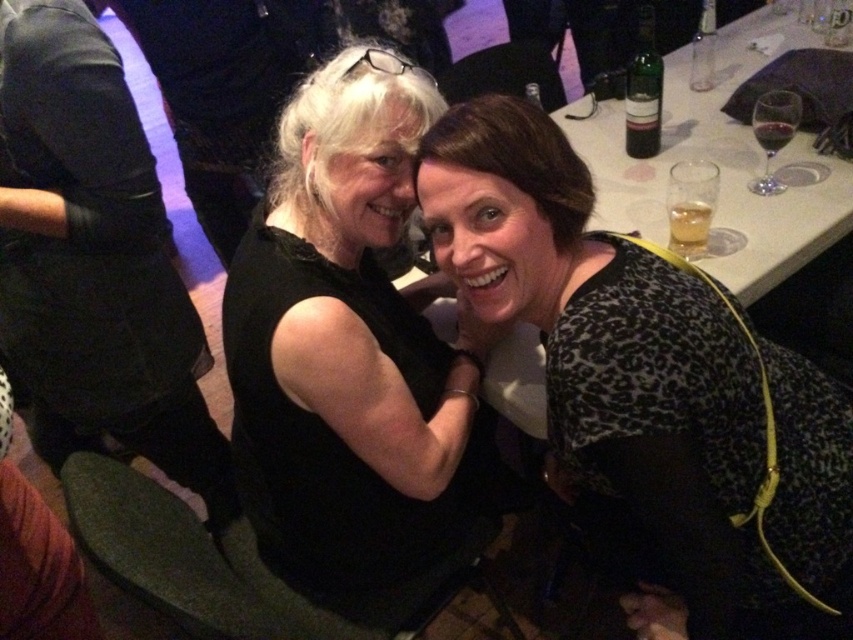
You are a bartender who needs to serve a drink to the person wearing the black matte dress at center. The drink must be placed within 24 inches of them. Can you place the drink at the translucent plastic cup at upper right?

The distance between the black matte dress at center and the translucent plastic cup at upper right is 25.35 inches, which is slightly more than the required 24 inches. Therefore, placing the drink at the translucent plastic cup at upper right would not meet the requirement.

You are a bartender preparing drinks and see the green glass bottle at upper right and the translucent plastic cup at upper right. Which object is taller?

The green glass bottle at upper right is much taller than the translucent plastic cup at upper right.

You are a bartender who needs to reach the green glass bottle at upper right from your current position. The shortest distance between you and the bottle is 1.76 meters. If your maximum reach without moving is 1.5 meters, can you grab it?

The shortest distance between you and the green glass bottle at upper right is 1.76 meters, which is beyond your maximum reach of 1.5 meters. You need to move closer to grab it.